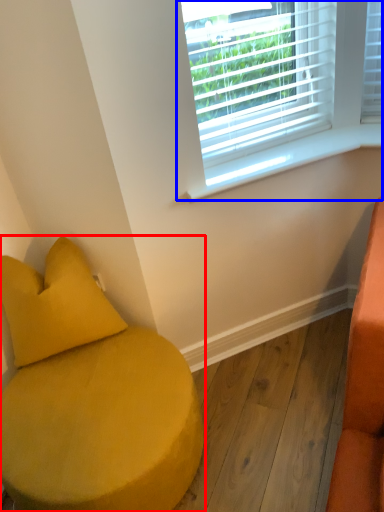
Question: Which object appears closest to the camera in this image, furniture (highlighted by a red box) or window (highlighted by a blue box)?

Choices:
 (A) furniture
 (B) window

Answer: (A)